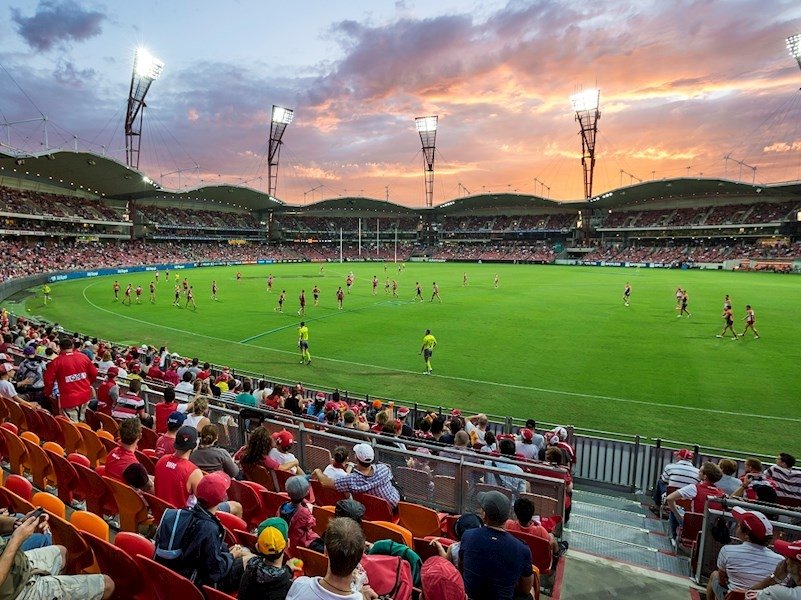
The width and height of the screenshot is (801, 600). I want to click on orange seat, so click(x=417, y=518).